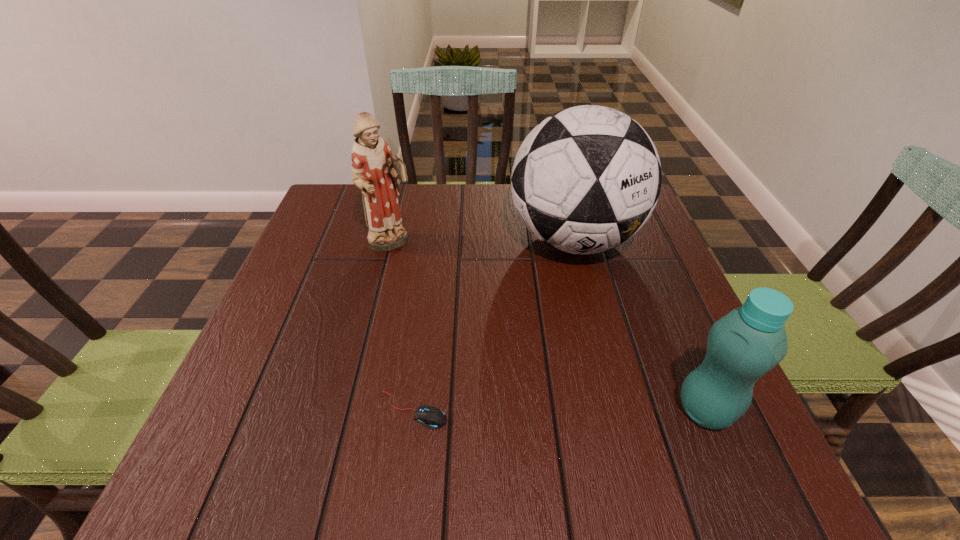
Find the location of a particular element. vacant space located 0.090m on the front-facing side of the figurine is located at coordinates (428, 273).

This screenshot has height=540, width=960. In order to click on soccer ball situated at the far edge in this screenshot , I will do `click(586, 179)`.

At what (x,y) coordinates should I click in order to perform the action: click on figurine that is at the far edge. Please return your answer as a coordinate pair (x, y). The image size is (960, 540). Looking at the image, I should click on (375, 171).

The width and height of the screenshot is (960, 540). Find the location of `mouse located at the near edge`. mouse located at the near edge is located at coordinates (431, 417).

This screenshot has height=540, width=960. Find the location of `water bottle at the near edge`. water bottle at the near edge is located at coordinates (748, 342).

Locate an element on the screen. The height and width of the screenshot is (540, 960). object at the left edge is located at coordinates (375, 171).

Locate an element on the screen. water bottle situated at the right edge is located at coordinates (748, 342).

Locate an element on the screen. Image resolution: width=960 pixels, height=540 pixels. soccer ball positioned at the right edge is located at coordinates (586, 179).

At what (x,y) coordinates should I click in order to perform the action: click on object that is at the far left corner. Please return your answer as a coordinate pair (x, y). The image size is (960, 540). Looking at the image, I should click on (375, 171).

At what (x,y) coordinates should I click in order to perform the action: click on object that is at the far right corner. Please return your answer as a coordinate pair (x, y). Image resolution: width=960 pixels, height=540 pixels. Looking at the image, I should click on (586, 179).